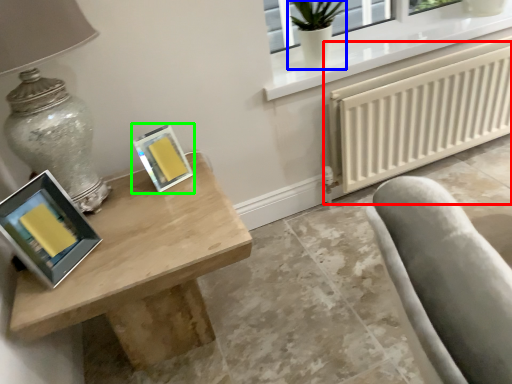
Question: Based on their relative distances, which object is nearer to radiator (highlighted by a red box)? Choose from glass vase (highlighted by a blue box) and picture frame (highlighted by a green box).

Choices:
 (A) glass vase
 (B) picture frame

Answer: (A)